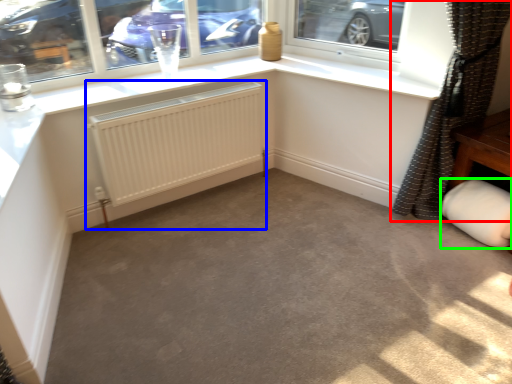
Question: Estimate the real-world distances between objects in this image. Which object is farther from curtain (highlighted by a red box), radiator (highlighted by a blue box) or gray (highlighted by a green box)?

Choices:
 (A) radiator
 (B) gray

Answer: (A)